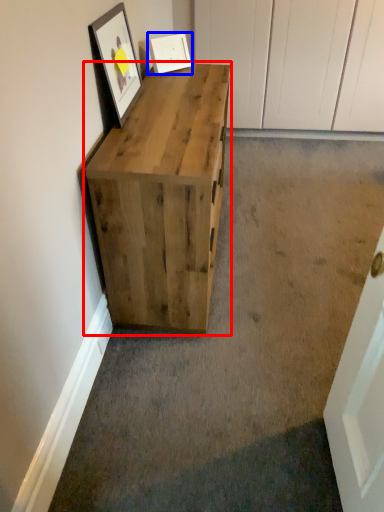
Question: Among these objects, which one is nearest to the camera, chest of drawers (highlighted by a red box) or picture frame (highlighted by a blue box)?

Choices:
 (A) chest of drawers
 (B) picture frame

Answer: (A)